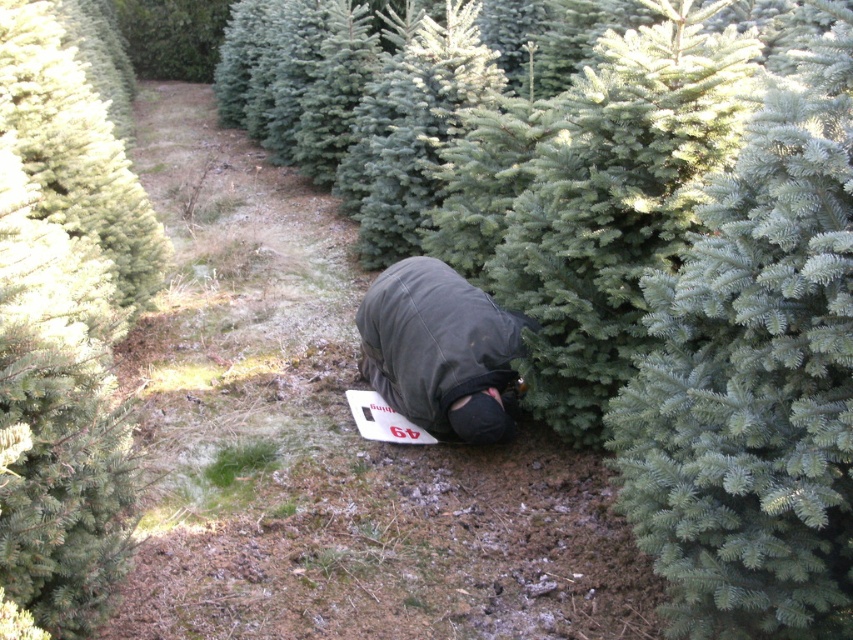
You are a customer at the Christmas tree farm and want to choose a tree to take home. You see the green matte evergreen tree at center and the dark gray fabric snowboard at center. Which object is wider?

The green matte evergreen tree at center might be wider than the dark gray fabric snowboard at center.

You are a customer at the Christmas tree farm and want to buy both the green matte evergreen tree at center and the dark gray fabric snowboard at center. If you stand between them, which item would be on your right side?

The dark gray fabric snowboard at center is on your right side because the green matte evergreen tree at center is to the left of it.

You are standing at the point labeled point (x=59, y=264) and want to walk to the point labeled point (x=432, y=432). Which direction should you face to walk straight towards your destination?

You should face towards the direction of point (x=432, y=432), which is behind point (x=59, y=264). Since point (x=59, y=264) is in front of point (x=432, y=432), you need to turn around and walk backward to reach your destination.